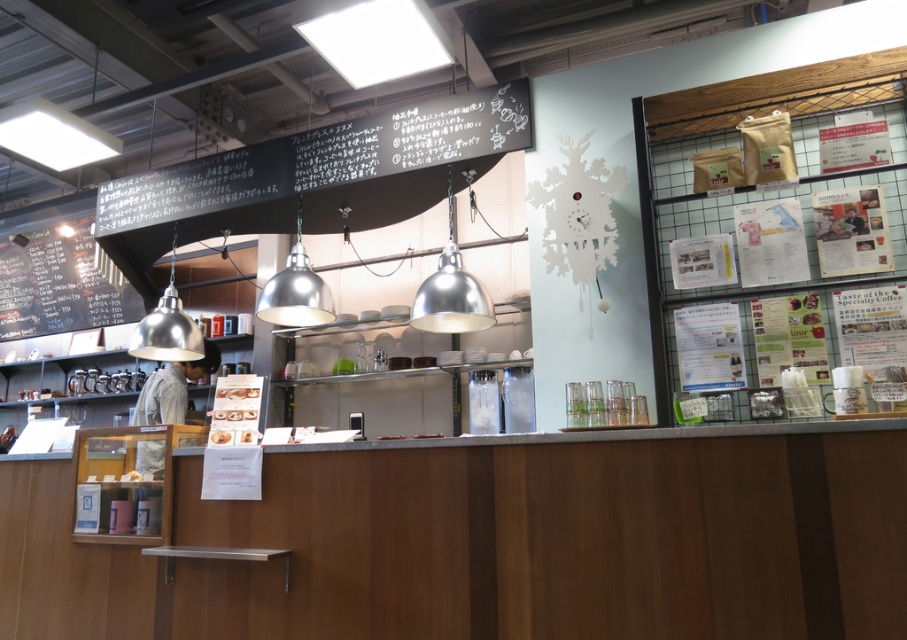
Question: Among these objects, which one is farthest from the camera?

Choices:
 (A) black chalkboard menu at upper center
 (B) black chalkboard menu at left

Answer: (B)

Question: Which point is farther to the camera?

Choices:
 (A) (187, 179)
 (B) (31, 250)

Answer: (B)

Question: Which of the following is the closest to the observer?

Choices:
 (A) black chalkboard menu at left
 (B) black chalkboard menu at upper center

Answer: (B)

Question: Is black chalkboard menu at upper center further to camera compared to black chalkboard menu at left?

Choices:
 (A) no
 (B) yes

Answer: (A)

Question: Can you confirm if black chalkboard menu at upper center is thinner than black chalkboard menu at left?

Choices:
 (A) no
 (B) yes

Answer: (A)

Question: Can you confirm if black chalkboard menu at upper center is positioned to the right of black chalkboard menu at left?

Choices:
 (A) yes
 (B) no

Answer: (A)